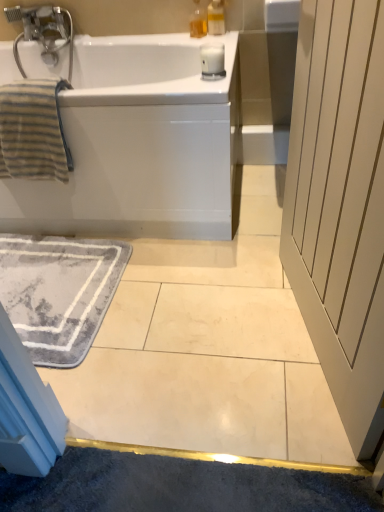
At what (x,y) coordinates should I click in order to perform the action: click on free space behind white wood screen door at right. Please return your answer as a coordinate pair (x, y). Looking at the image, I should click on coord(235,262).